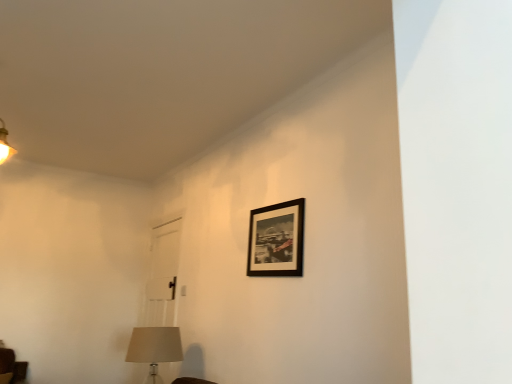
Question: From a real-world perspective, is beige fabric lampshade at lower left under black matte picture frame at upper center?

Choices:
 (A) yes
 (B) no

Answer: (A)

Question: Are beige fabric lampshade at lower left and black matte picture frame at upper center far apart?

Choices:
 (A) no
 (B) yes

Answer: (B)

Question: Is beige fabric lampshade at lower left wider than black matte picture frame at upper center?

Choices:
 (A) yes
 (B) no

Answer: (A)

Question: From the image's perspective, is beige fabric lampshade at lower left beneath black matte picture frame at upper center?

Choices:
 (A) yes
 (B) no

Answer: (A)

Question: Does beige fabric lampshade at lower left come in front of black matte picture frame at upper center?

Choices:
 (A) yes
 (B) no

Answer: (B)

Question: Is beige fabric lampshade at lower left bigger than black matte picture frame at upper center?

Choices:
 (A) yes
 (B) no

Answer: (A)

Question: Does black matte picture frame at upper center appear on the right side of beige fabric lampshade at lower left?

Choices:
 (A) no
 (B) yes

Answer: (B)

Question: Is black matte picture frame at upper center oriented towards beige fabric lampshade at lower left?

Choices:
 (A) no
 (B) yes

Answer: (A)

Question: Is black matte picture frame at upper center not close to beige fabric lampshade at lower left?

Choices:
 (A) no
 (B) yes

Answer: (B)

Question: Is black matte picture frame at upper center oriented away from beige fabric lampshade at lower left?

Choices:
 (A) yes
 (B) no

Answer: (B)

Question: Considering the relative sizes of black matte picture frame at upper center and beige fabric lampshade at lower left in the image provided, is black matte picture frame at upper center taller than beige fabric lampshade at lower left?

Choices:
 (A) yes
 (B) no

Answer: (B)

Question: Is black matte picture frame at upper center bigger than beige fabric lampshade at lower left?

Choices:
 (A) yes
 (B) no

Answer: (B)

Question: From a real-world perspective, relative to black matte picture frame at upper center, is beige fabric lampshade at lower left vertically above or below?

Choices:
 (A) below
 (B) above

Answer: (A)